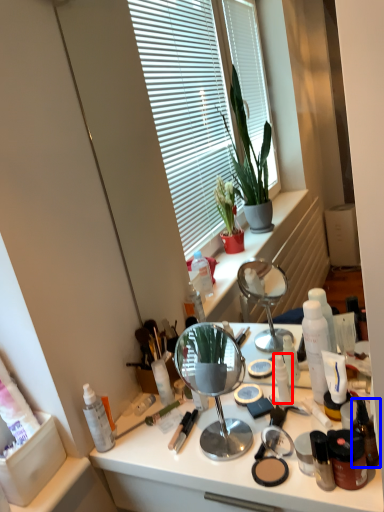
Question: Which object is closer to the camera taking this photo, toiletry (highlighted by a red box) or toiletry (highlighted by a blue box)?

Choices:
 (A) toiletry
 (B) toiletry

Answer: (B)